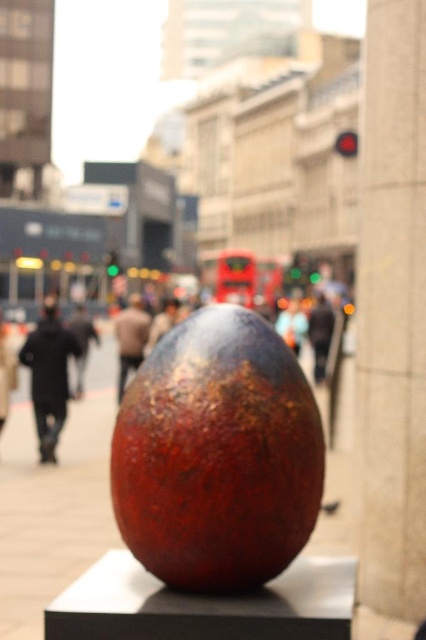
Question: Where is dark brown leather jacket at lower left located in relation to brown leather jacket at center in the image?

Choices:
 (A) below
 (B) above

Answer: (A)

Question: Is dark brown leather jacket at lower left further to camera compared to brown leather jacket at center?

Choices:
 (A) yes
 (B) no

Answer: (B)

Question: Among these objects, which one is nearest to the camera?

Choices:
 (A) dark brown leather jacket at lower left
 (B) brown leather jacket at center

Answer: (A)

Question: Does dark brown leather jacket at lower left have a greater width compared to dark brown leather jacket at center?

Choices:
 (A) no
 (B) yes

Answer: (A)

Question: Which point is closer to the camera?

Choices:
 (A) (319, 317)
 (B) (131, 353)
 (C) (48, 419)
 (D) (74, 417)

Answer: (C)

Question: Which of the following is the farthest from the observer?

Choices:
 (A) dark brown leather jacket at lower left
 (B) shiny metallic sphere at center
 (C) brown leather jacket at center
 (D) dark brown leather jacket at center

Answer: (D)